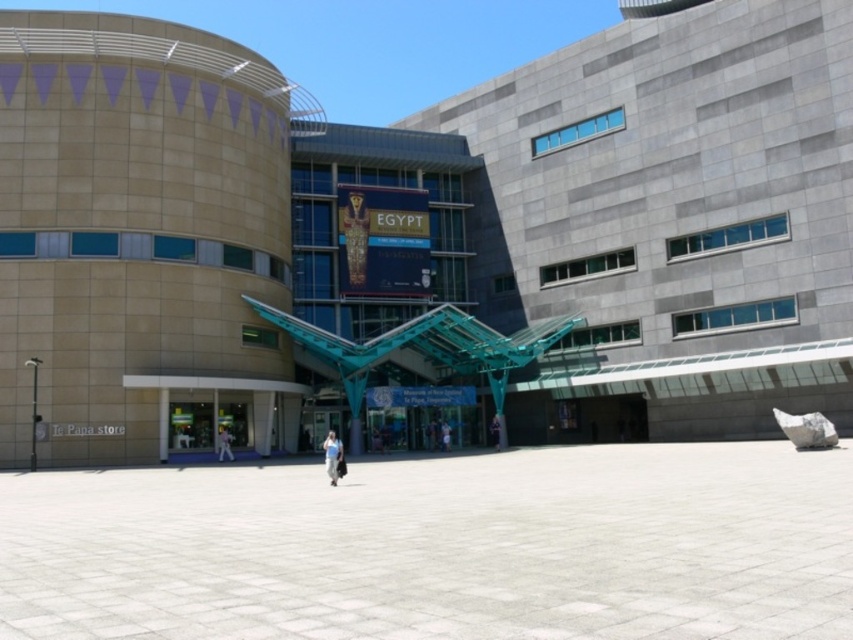
Question: Among these points, which one is farthest from the camera?

Choices:
 (A) (431, 300)
 (B) (222, 442)

Answer: (A)

Question: From the image, what is the correct spatial relationship of beige stone building at center in relation to light blue jeans at center?

Choices:
 (A) left
 (B) right

Answer: (B)

Question: Which object appears closest to the camera in this image?

Choices:
 (A) dark blue jeans at center
 (B) white fabric person at center

Answer: (B)

Question: Does white fabric person at center appear on the left side of dark blue jeans at center?

Choices:
 (A) yes
 (B) no

Answer: (A)

Question: Among these points, which one is nearest to the camera?

Choices:
 (A) (343, 460)
 (B) (225, 452)
 (C) (491, 428)

Answer: (A)

Question: Observing the image, what is the correct spatial positioning of beige stone building at center in reference to light blue jeans at center?

Choices:
 (A) left
 (B) right

Answer: (B)